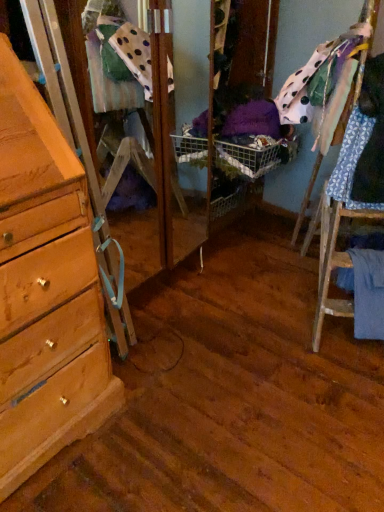
Question: From the image's perspective, is polka dot fabric at upper right, placed as the first clothing when sorted from top to bottom, above or below blue patterned fabric at right, the second clothing from the top?

Choices:
 (A) above
 (B) below

Answer: (A)

Question: Considering the positions of polka dot fabric at upper right, the 3th clothing ordered from the bottom, and blue patterned fabric at right, the second clothing from the top, in the image, is polka dot fabric at upper right, the 3th clothing ordered from the bottom, taller or shorter than blue patterned fabric at right, the second clothing from the top,?

Choices:
 (A) tall
 (B) short

Answer: (A)

Question: Which object is the closest to the blue fabric at lower right, which is counted as the first clothing, starting from the bottom?

Choices:
 (A) polka dot fabric at upper right, the 3th clothing ordered from the bottom
 (B) blue patterned fabric at right, the second clothing from the top

Answer: (B)

Question: Considering the real-world distances, which object is farthest from the blue fabric at lower right, marked as the third clothing in a top-to-bottom arrangement?

Choices:
 (A) blue patterned fabric at right, the second clothing from the top
 (B) polka dot fabric at upper right, the 3th clothing ordered from the bottom

Answer: (B)